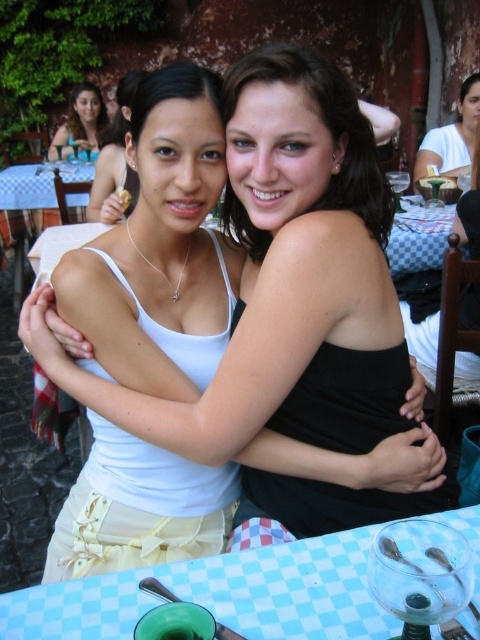
Can you confirm if white matte shirt at upper center is positioned to the right of matte white plate at center?

Indeed, white matte shirt at upper center is positioned on the right side of matte white plate at center.

Between white matte shirt at upper center and matte white plate at center, which one has less height?

Standing shorter between the two is matte white plate at center.

Does point (468, 93) lie behind point (116, 188)?

Yes.

This screenshot has width=480, height=640. I want to click on white matte shirt at upper center, so click(x=452, y=138).

Is point (92, 141) behind point (120, 196)?

That is True.

In the scene shown: Between matte black hair at upper left and matte white plate at center, which one has more height?

Standing taller between the two is matte black hair at upper left.

Is point (74, 97) closer to camera compared to point (120, 196)?

No, (74, 97) is further to viewer.

Locate an element on the screen. matte black hair at upper left is located at coordinates (80, 122).

Describe the element at coordinates (291, 307) in the screenshot. I see `white matte tank top at center` at that location.

At what (x,y) coordinates should I click in order to perform the action: click on white matte tank top at center. Please return your answer as a coordinate pair (x, y). The image size is (480, 640). Looking at the image, I should click on [291, 307].